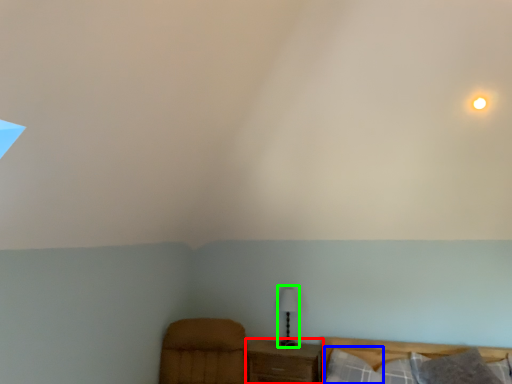
Question: Which is nearer to the nightstand (highlighted by a red box)? pillow (highlighted by a blue box) or table lamp (highlighted by a green box).

Choices:
 (A) pillow
 (B) table lamp

Answer: (A)